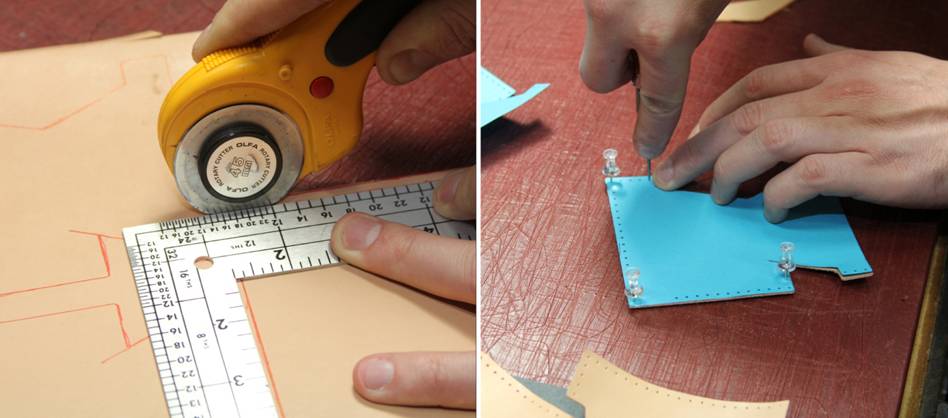
This screenshot has width=948, height=418. What are the coordinates of `table` in the screenshot? It's located at (534, 201).